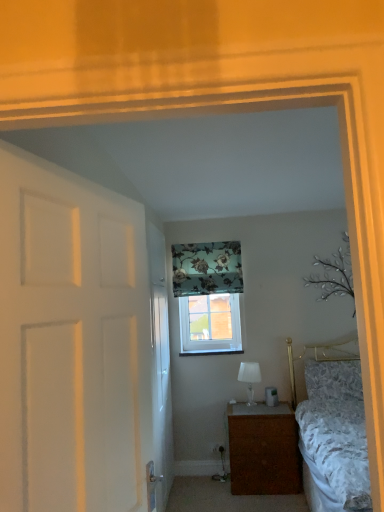
Question: Is clear glass window at center next to white glossy table lamp at center?

Choices:
 (A) no
 (B) yes

Answer: (A)

Question: From a real-world perspective, is clear glass window at center below white glossy table lamp at center?

Choices:
 (A) no
 (B) yes

Answer: (A)

Question: Is clear glass window at center shorter than white glossy table lamp at center?

Choices:
 (A) yes
 (B) no

Answer: (B)

Question: Is clear glass window at center positioned before white glossy table lamp at center?

Choices:
 (A) no
 (B) yes

Answer: (A)

Question: Is clear glass window at center taller than white glossy table lamp at center?

Choices:
 (A) no
 (B) yes

Answer: (B)

Question: Considering the positions of brown wood nightstand at lower center and floral fabric curtain at upper center in the image, is brown wood nightstand at lower center taller or shorter than floral fabric curtain at upper center?

Choices:
 (A) short
 (B) tall

Answer: (B)

Question: Based on their sizes in the image, would you say brown wood nightstand at lower center is bigger or smaller than floral fabric curtain at upper center?

Choices:
 (A) big
 (B) small

Answer: (A)

Question: Is brown wood nightstand at lower center in front of or behind floral fabric curtain at upper center in the image?

Choices:
 (A) behind
 (B) front

Answer: (B)

Question: From a real-world perspective, relative to floral fabric curtain at upper center, is brown wood nightstand at lower center vertically above or below?

Choices:
 (A) above
 (B) below

Answer: (B)

Question: From a real-world perspective, relative to white matte door at left, the first door viewed from the front, is brown wood nightstand at lower center vertically above or below?

Choices:
 (A) above
 (B) below

Answer: (B)

Question: In terms of height, does brown wood nightstand at lower center look taller or shorter compared to white matte door at left, the first door viewed from the front?

Choices:
 (A) tall
 (B) short

Answer: (B)

Question: Considering their positions, is brown wood nightstand at lower center located in front of or behind white matte door at left, which is counted as the second door, starting from the back?

Choices:
 (A) front
 (B) behind

Answer: (B)

Question: Looking at their shapes, would you say brown wood nightstand at lower center is wider or thinner than white matte door at left, the first door viewed from the front?

Choices:
 (A) wide
 (B) thin

Answer: (A)

Question: In terms of width, does white glossy door at center, the 2th door positioned from the front, look wider or thinner when compared to floral fabric curtain at upper center?

Choices:
 (A) thin
 (B) wide

Answer: (A)

Question: Looking at the image, does white glossy door at center, the 2th door positioned from the front, seem bigger or smaller compared to floral fabric curtain at upper center?

Choices:
 (A) small
 (B) big

Answer: (B)